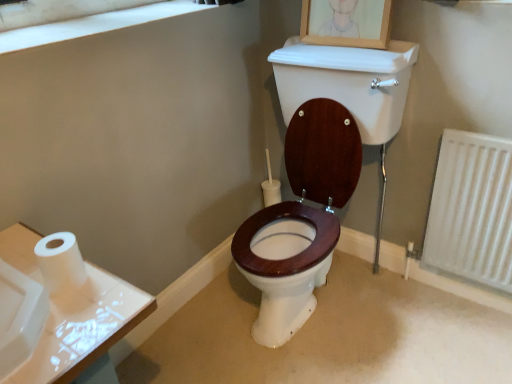
Find the location of `white matte toilet paper at left`. white matte toilet paper at left is located at coordinates (60, 262).

Image resolution: width=512 pixels, height=384 pixels. I want to click on white matte toilet paper at left, so click(x=60, y=262).

In the scene shown: Does white matte window frame at upper left have a larger size compared to white matte toilet paper at left?

Yes.

In terms of height, does white matte window frame at upper left look taller or shorter compared to white matte toilet paper at left?

In the image, white matte window frame at upper left appears to be shorter than white matte toilet paper at left.

Does white matte window frame at upper left turn towards white matte toilet paper at left?

No, white matte window frame at upper left is not aimed at white matte toilet paper at left.

From the image's perspective, between white matte window frame at upper left and white matte toilet paper at left, who is located below?

white matte toilet paper at left, from the image's perspective.

Is the depth of white textured radiator at lower right less than that of white matte toilet paper at left?

That is False.

Find the location of a particular element. The height and width of the screenshot is (384, 512). radiator that appears below the white matte toilet paper at left (from a real-world perspective) is located at coordinates (471, 209).

Which is closer, [457,200] or [45,281]?

The point [45,281] is closer.

Which of these two, white textured radiator at lower right or white matte toilet paper at left, stands taller?

With more height is white textured radiator at lower right.

Is white matte toilet paper at left oriented towards white matte window frame at upper left?

No, white matte toilet paper at left is not facing towards white matte window frame at upper left.

How distant is white matte toilet paper at left from white matte window frame at upper left?

They are 27.23 inches apart.

In the scene shown: From a real-world perspective, is white matte toilet paper at left physically located above or below white matte window frame at upper left?

Clearly, from a real-world perspective, white matte toilet paper at left is below white matte window frame at upper left.

Can you confirm if white matte toilet paper at left is taller than white matte window frame at upper left?

Indeed, white matte toilet paper at left has a greater height compared to white matte window frame at upper left.

From a real-world perspective, does wooden picture frame at upper center stand above white textured radiator at lower right?

Yes, from a real-world perspective, wooden picture frame at upper center is over white textured radiator at lower right

Is wooden picture frame at upper center at the left side of white textured radiator at lower right?

Indeed, wooden picture frame at upper center is positioned on the left side of white textured radiator at lower right.

Is wooden picture frame at upper center not within white textured radiator at lower right?

Yes, wooden picture frame at upper center is outside of white textured radiator at lower right.

From the image's perspective, between wooden picture frame at upper center and white textured radiator at lower right, who is located below?

white textured radiator at lower right, from the image's perspective.

From the image's perspective, which one is positioned higher, white matte toilet paper at left or white textured radiator at lower right?

white textured radiator at lower right, from the image's perspective.

Is white matte toilet paper at left shorter than white textured radiator at lower right?

Indeed, white matte toilet paper at left has a lesser height compared to white textured radiator at lower right.

The image size is (512, 384). Find the location of `toilet paper in front of the white textured radiator at lower right`. toilet paper in front of the white textured radiator at lower right is located at coordinates (60, 262).

In terms of size, does white matte toilet paper at left appear bigger or smaller than white textured radiator at lower right?

Considering their sizes, white matte toilet paper at left takes up less space than white textured radiator at lower right.

Is white matte toilet paper at left aimed at wooden picture frame at upper center?

No, white matte toilet paper at left is not oriented towards wooden picture frame at upper center.

Is white matte toilet paper at left to the right of wooden picture frame at upper center from the viewer's perspective?

No.

From the image's perspective, is white matte toilet paper at left on wooden picture frame at upper center?

Actually, white matte toilet paper at left appears below wooden picture frame at upper center in the image.

Considering the sizes of objects white matte toilet paper at left and wooden picture frame at upper center in the image provided, who is bigger, white matte toilet paper at left or wooden picture frame at upper center?

Bigger between the two is wooden picture frame at upper center.

Which is more to the left, wooden picture frame at upper center or white matte toilet paper at left?

white matte toilet paper at left is more to the left.

Does wooden picture frame at upper center contain white matte toilet paper at left?

That's incorrect, white matte toilet paper at left is not inside wooden picture frame at upper center.

Where is `picture frame behind the white matte toilet paper at left`? picture frame behind the white matte toilet paper at left is located at coordinates pyautogui.click(x=348, y=23).

Is wooden picture frame at upper center positioned behind white matte toilet paper at left?

Yes, it is behind white matte toilet paper at left.

In the image, there is a white matte window frame at upper left. Where is `toilet paper below it (from the image's perspective)`? The height and width of the screenshot is (384, 512). toilet paper below it (from the image's perspective) is located at coordinates (60, 262).

Image resolution: width=512 pixels, height=384 pixels. Find the location of `toilet paper to the left of white textured radiator at lower right`. toilet paper to the left of white textured radiator at lower right is located at coordinates [x=60, y=262].

Considering their positions, is white matte window frame at upper left positioned closer to white textured radiator at lower right than white matte toilet paper at left?

white matte window frame at upper left is closer to white textured radiator at lower right.

Looking at the image, which one is located further to white matte toilet paper at left, white matte window frame at upper left or white textured radiator at lower right?

white textured radiator at lower right is positioned further to the anchor white matte toilet paper at left.

Looking at the image, which one is located closer to white matte window frame at upper left, wooden picture frame at upper center or white textured radiator at lower right?

wooden picture frame at upper center is positioned closer to the anchor white matte window frame at upper left.

When comparing their distances from wooden picture frame at upper center, does white textured radiator at lower right or white matte window frame at upper left seem further?

Among the two, white textured radiator at lower right is located further to wooden picture frame at upper center.

Based on their spatial positions, is white textured radiator at lower right or white matte toilet paper at left further from white matte window frame at upper left?

white textured radiator at lower right.

When comparing their distances from white textured radiator at lower right, does white matte toilet paper at left or wooden picture frame at upper center seem further?

white matte toilet paper at left is positioned further to the anchor white textured radiator at lower right.

Which object lies further to the anchor point wooden picture frame at upper center, white matte window frame at upper left or white textured radiator at lower right?

white textured radiator at lower right.

Considering their positions, is white textured radiator at lower right positioned closer to white matte toilet paper at left than wooden picture frame at upper center?

Among the two, wooden picture frame at upper center is located nearer to white matte toilet paper at left.

Where is `toilet paper between white matte window frame at upper left and white textured radiator at lower right in the horizontal direction`? The height and width of the screenshot is (384, 512). toilet paper between white matte window frame at upper left and white textured radiator at lower right in the horizontal direction is located at coordinates (60, 262).

This screenshot has height=384, width=512. Identify the location of toilet paper located between white matte window frame at upper left and wooden picture frame at upper center in the left-right direction. (60, 262).

The width and height of the screenshot is (512, 384). In order to click on picture frame between white matte toilet paper at left and white textured radiator at lower right from left to right in this screenshot , I will do click(x=348, y=23).

This screenshot has width=512, height=384. Identify the location of picture frame situated between white matte window frame at upper left and white textured radiator at lower right from left to right. (348, 23).